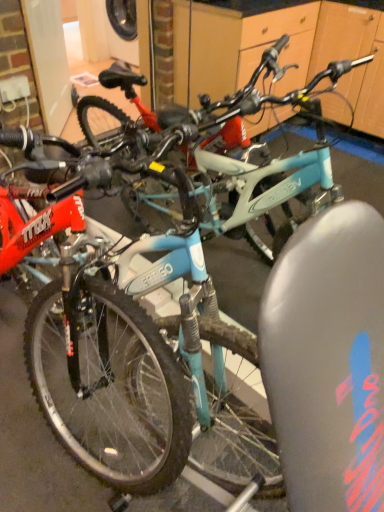
Question: Is matte blue bicycle at center, the second bicycle in the top-to-bottom sequence, bigger than matte blue bicycle at center, the first bicycle in the top-to-bottom sequence?

Choices:
 (A) yes
 (B) no

Answer: (A)

Question: Is matte blue bicycle at center, arranged as the 1th bicycle when ordered from the bottom, smaller than matte blue bicycle at center, which ranks as the 2th bicycle in bottom-to-top order?

Choices:
 (A) yes
 (B) no

Answer: (B)

Question: Is matte blue bicycle at center, arranged as the 1th bicycle when ordered from the bottom, looking in the opposite direction of matte blue bicycle at center, which ranks as the 2th bicycle in bottom-to-top order?

Choices:
 (A) yes
 (B) no

Answer: (B)

Question: Does matte blue bicycle at center, the second bicycle in the top-to-bottom sequence, lie in front of matte blue bicycle at center, the first bicycle in the top-to-bottom sequence?

Choices:
 (A) no
 (B) yes

Answer: (B)

Question: From a real-world perspective, is matte blue bicycle at center, the second bicycle in the top-to-bottom sequence, physically above matte blue bicycle at center, which ranks as the 2th bicycle in bottom-to-top order?

Choices:
 (A) yes
 (B) no

Answer: (B)

Question: Is matte blue bicycle at center, arranged as the 1th bicycle when ordered from the bottom, not near matte blue bicycle at center, which ranks as the 2th bicycle in bottom-to-top order?

Choices:
 (A) yes
 (B) no

Answer: (B)

Question: From a real-world perspective, does matte blue bicycle at center, the first bicycle in the top-to-bottom sequence, stand above matte blue bicycle at center, the second bicycle in the top-to-bottom sequence?

Choices:
 (A) yes
 (B) no

Answer: (A)

Question: Would you say matte blue bicycle at center, the second bicycle in the top-to-bottom sequence, is part of matte blue bicycle at center, which ranks as the 2th bicycle in bottom-to-top order,'s contents?

Choices:
 (A) yes
 (B) no

Answer: (B)

Question: From a real-world perspective, does matte blue bicycle at center, which ranks as the 2th bicycle in bottom-to-top order, sit lower than matte blue bicycle at center, arranged as the 1th bicycle when ordered from the bottom?

Choices:
 (A) no
 (B) yes

Answer: (A)

Question: Considering the relative positions of matte blue bicycle at center, which ranks as the 2th bicycle in bottom-to-top order, and matte blue bicycle at center, arranged as the 1th bicycle when ordered from the bottom, in the image provided, is matte blue bicycle at center, which ranks as the 2th bicycle in bottom-to-top order, to the right of matte blue bicycle at center, arranged as the 1th bicycle when ordered from the bottom, from the viewer's perspective?

Choices:
 (A) yes
 (B) no

Answer: (B)

Question: From the image's perspective, does matte blue bicycle at center, which ranks as the 2th bicycle in bottom-to-top order, appear lower than matte blue bicycle at center, arranged as the 1th bicycle when ordered from the bottom?

Choices:
 (A) yes
 (B) no

Answer: (B)

Question: Could you tell me if matte blue bicycle at center, the first bicycle in the top-to-bottom sequence, is turned towards matte blue bicycle at center, the second bicycle in the top-to-bottom sequence?

Choices:
 (A) yes
 (B) no

Answer: (A)

Question: Is matte blue bicycle at center, arranged as the 1th bicycle when ordered from the bottom, to the left or to the right of matte blue bicycle at center, the first bicycle in the top-to-bottom sequence, in the image?

Choices:
 (A) right
 (B) left

Answer: (A)